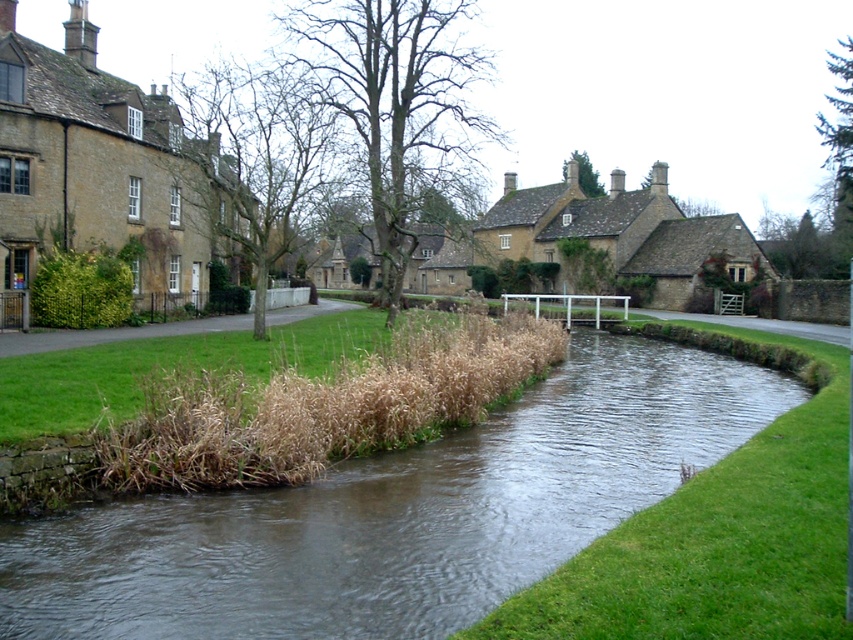
Does brown grassy stream at center have a smaller size compared to matte stone houses at center?

Indeed, brown grassy stream at center has a smaller size compared to matte stone houses at center.

At what (x,y) coordinates should I click in order to perform the action: click on brown grassy stream at center. Please return your answer as a coordinate pair (x, y). Looking at the image, I should click on (396, 515).